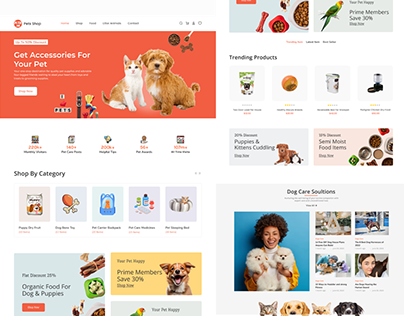
At what (x,y) coordinates should I click in order to perform the action: click on green pet food dish. Please return your answer as a coordinate pair (x, y). This screenshot has height=316, width=404. Looking at the image, I should click on (356, 159), (89, 291).